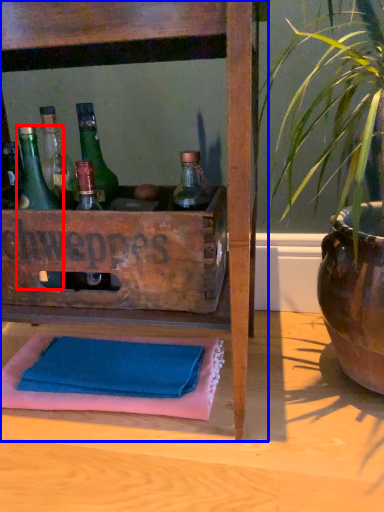
Question: Which object is closer to the camera taking this photo, bottle (highlighted by a red box) or furniture (highlighted by a blue box)?

Choices:
 (A) bottle
 (B) furniture

Answer: (B)